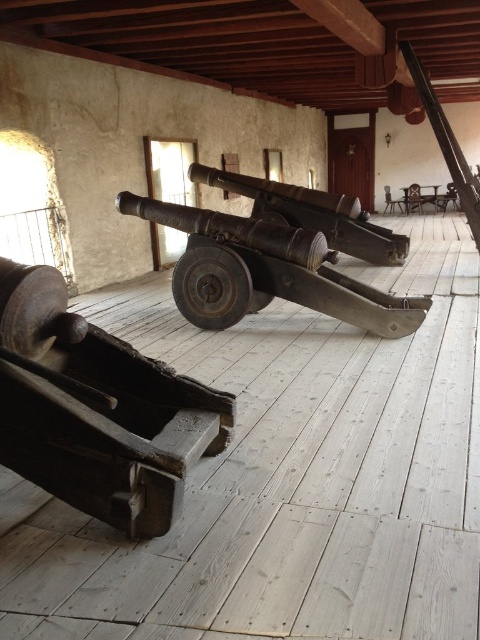
Who is more forward, (146, 504) or (252, 264)?

Point (146, 504)

This screenshot has width=480, height=640. I want to click on rusty metal cannon at lower left, so click(x=96, y=410).